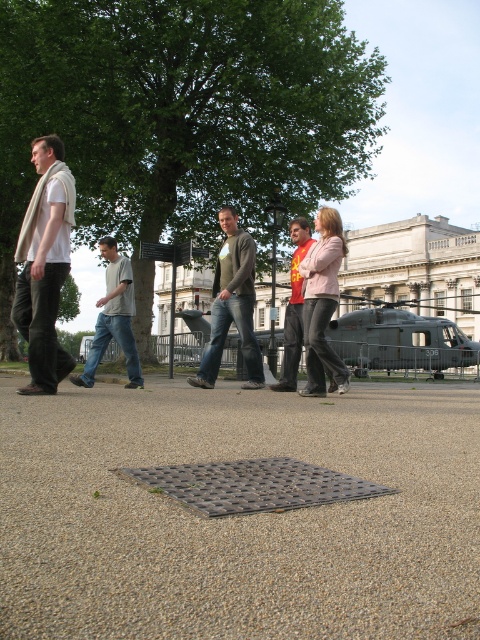
Question: Which object is the closest to the yellow jersey at center?

Choices:
 (A) light gray cotton shirt at center
 (B) gray textured pavement at center
 (C) dark gray concrete helicopter at center
 (D) green textured sweater at center

Answer: (D)

Question: Can you confirm if green textured sweater at center is thinner than matte pink sweater at center?

Choices:
 (A) yes
 (B) no

Answer: (B)

Question: Can you confirm if beige scarf at left is positioned below light gray cotton shirt at center?

Choices:
 (A) no
 (B) yes

Answer: (B)

Question: Which of the following is the farthest from the observer?

Choices:
 (A) tap(471, 307)
 (B) tap(370, 404)
 (C) tap(314, 387)

Answer: (A)

Question: Which object is closer to the camera taking this photo?

Choices:
 (A) beige scarf at left
 (B) dark gray concrete helicopter at center

Answer: (A)

Question: Does gray textured pavement at center appear under matte pink sweater at center?

Choices:
 (A) no
 (B) yes

Answer: (B)